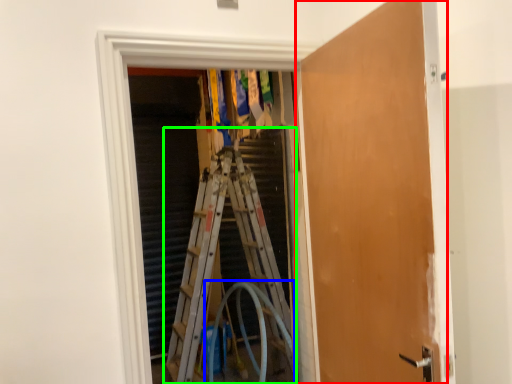
Question: Considering the real-world distances, which object is closest to door (highlighted by a red box)? garden hose (highlighted by a blue box) or ladder (highlighted by a green box).

Choices:
 (A) garden hose
 (B) ladder

Answer: (A)